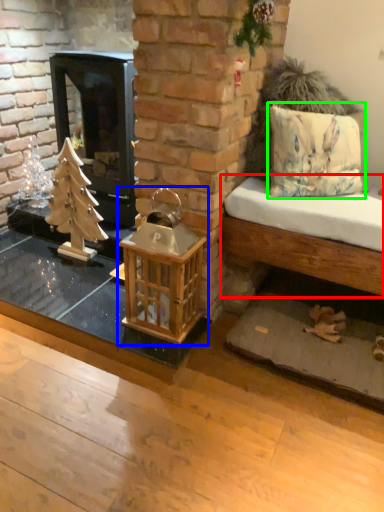
Question: Which object is positioned farthest from furniture (highlighted by a red box)? Select from bird cage (highlighted by a blue box) and pillow (highlighted by a green box).

Choices:
 (A) bird cage
 (B) pillow

Answer: (A)